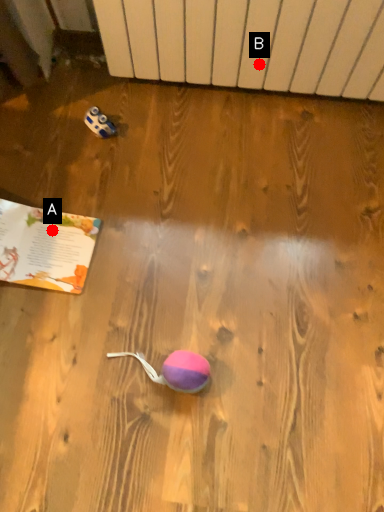
Question: Two points are circled on the image, labeled by A and B beside each circle. Which point is closer to the camera taking this photo?

Choices:
 (A) A is closer
 (B) B is closer

Answer: (A)